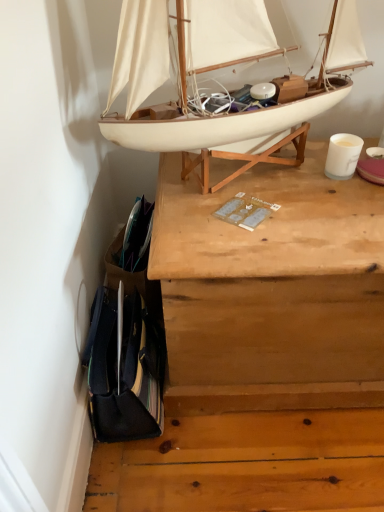
Question: Considering the relative sizes of white matte boat at upper center and wooden chest at upper center in the image provided, is white matte boat at upper center bigger than wooden chest at upper center?

Choices:
 (A) yes
 (B) no

Answer: (B)

Question: From the image's perspective, is white matte boat at upper center located above wooden chest at upper center?

Choices:
 (A) no
 (B) yes

Answer: (B)

Question: Is white matte boat at upper center far from wooden chest at upper center?

Choices:
 (A) yes
 (B) no

Answer: (B)

Question: Does white matte boat at upper center appear on the left side of wooden chest at upper center?

Choices:
 (A) no
 (B) yes

Answer: (B)

Question: Can you confirm if white matte boat at upper center is shorter than wooden chest at upper center?

Choices:
 (A) no
 (B) yes

Answer: (B)

Question: Is wooden chest at upper center at the back of white matte boat at upper center?

Choices:
 (A) no
 (B) yes

Answer: (A)

Question: Does wooden chest at upper center lie behind white matte boat at upper center?

Choices:
 (A) no
 (B) yes

Answer: (B)

Question: Does wooden chest at upper center have a smaller size compared to white matte boat at upper center?

Choices:
 (A) no
 (B) yes

Answer: (A)

Question: From a real-world perspective, is wooden chest at upper center located higher than white matte boat at upper center?

Choices:
 (A) no
 (B) yes

Answer: (A)

Question: Does wooden chest at upper center have a greater height compared to white matte boat at upper center?

Choices:
 (A) yes
 (B) no

Answer: (A)

Question: Is wooden chest at upper center outside of white matte boat at upper center?

Choices:
 (A) yes
 (B) no

Answer: (A)

Question: Is wooden chest at upper center closer to the viewer compared to white matte boat at upper center?

Choices:
 (A) yes
 (B) no

Answer: (B)

Question: From the image's perspective, relative to white matte boat at upper center, is wooden chest at upper center above or below?

Choices:
 (A) above
 (B) below

Answer: (B)